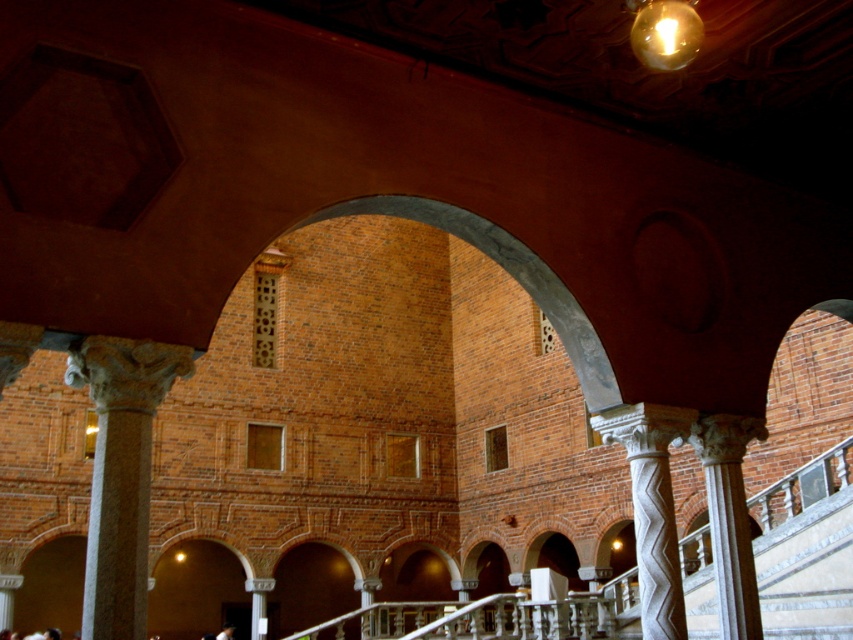
Question: Which object is positioned closest to the white carved column at center?

Choices:
 (A) white stone column at left
 (B) white marble column at center

Answer: (B)

Question: Does white stone column at left have a lesser width compared to white carved column at center?

Choices:
 (A) no
 (B) yes

Answer: (B)

Question: Does white carved column at center appear on the right side of white marble column at center?

Choices:
 (A) no
 (B) yes

Answer: (A)

Question: Based on their relative distances, which object is farther from the white marble column at center?

Choices:
 (A) white carved column at center
 (B) white stone column at left

Answer: (B)

Question: Is white stone column at left closer to camera compared to white marble column at center?

Choices:
 (A) no
 (B) yes

Answer: (B)

Question: Which object appears farthest from the camera in this image?

Choices:
 (A) white marble column at center
 (B) white stone column at left

Answer: (A)